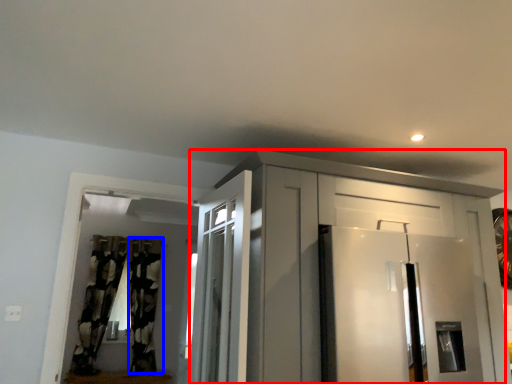
Question: Which object is further to the camera taking this photo, cabinetry (highlighted by a red box) or curtain (highlighted by a blue box)?

Choices:
 (A) cabinetry
 (B) curtain

Answer: (B)